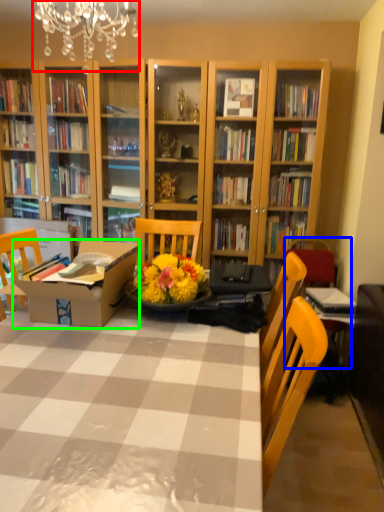
Question: Considering the real-world distances, which object is closest to light fixture (highlighted by a red box)? armchair (highlighted by a blue box) or cardboard box (highlighted by a green box).

Choices:
 (A) armchair
 (B) cardboard box

Answer: (B)